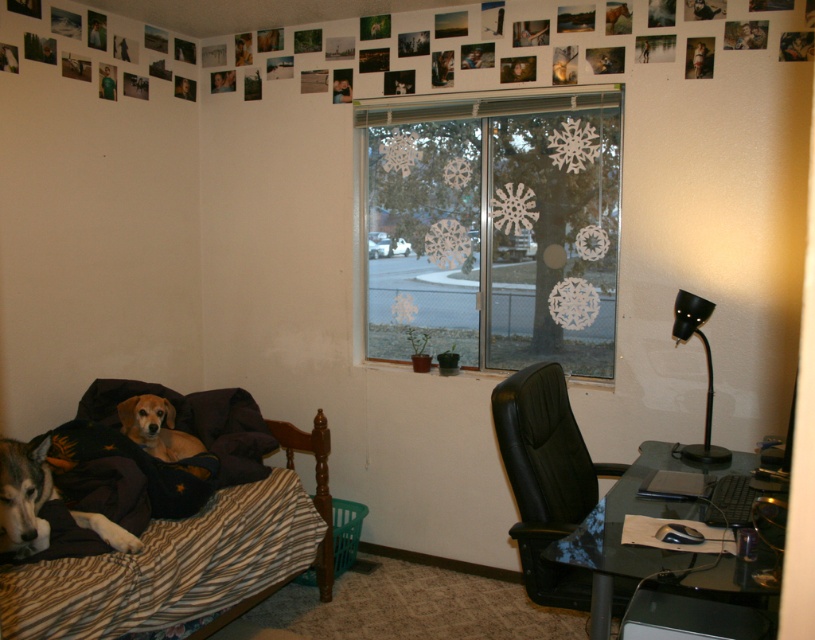
You are a delivery person standing at the white fur dog at lower left. You need to place a package on the black leather chair at center. Can you reach it without moving more than 4 feet?

The distance between the black leather chair at center and the white fur dog at lower left is 4.49 feet, so you would need to move more than 4 feet to reach the chair, making it unreachable within the specified limit.